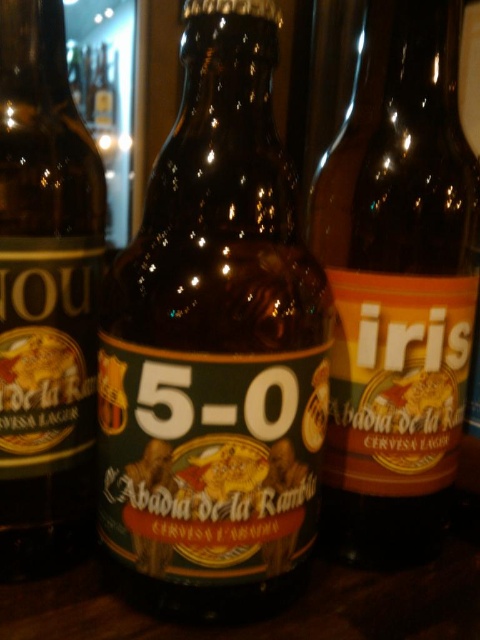
Describe the element at coordinates (215, 344) in the screenshot. This screenshot has height=640, width=480. I see `brown glass bottle at center` at that location.

Between brown glass bottle at center and brown glass bottle at left, which one appears on the right side from the viewer's perspective?

brown glass bottle at center

Describe the element at coordinates (215, 344) in the screenshot. This screenshot has width=480, height=640. I see `brown glass bottle at center` at that location.

Image resolution: width=480 pixels, height=640 pixels. Identify the location of brown glass bottle at center. (215, 344).

From the picture: Is brown glass bottle at center taller than matte glass bottle at right?

In fact, brown glass bottle at center may be shorter than matte glass bottle at right.

Who is positioned more to the right, brown glass bottle at center or matte glass bottle at right?

matte glass bottle at right is more to the right.

Is point (132, 486) closer to camera compared to point (365, 474)?

Yes, point (132, 486) is in front of point (365, 474).

You are a GUI agent. You are given a task and a screenshot of the screen. Output one action in this format:
    pyautogui.click(x=<x>, y=<y>)
    Task: Click on the brown glass bottle at center
    
    Given the screenshot: What is the action you would take?
    pyautogui.click(x=215, y=344)

Who is lower down, matte glass bottle at right or brown glass bottle at left?

brown glass bottle at left

Based on the photo, is matte glass bottle at right positioned in front of brown glass bottle at left?

No, matte glass bottle at right is behind brown glass bottle at left.

Describe the element at coordinates (397, 288) in the screenshot. I see `matte glass bottle at right` at that location.

Locate an element on the screen. The width and height of the screenshot is (480, 640). matte glass bottle at right is located at coordinates (397, 288).